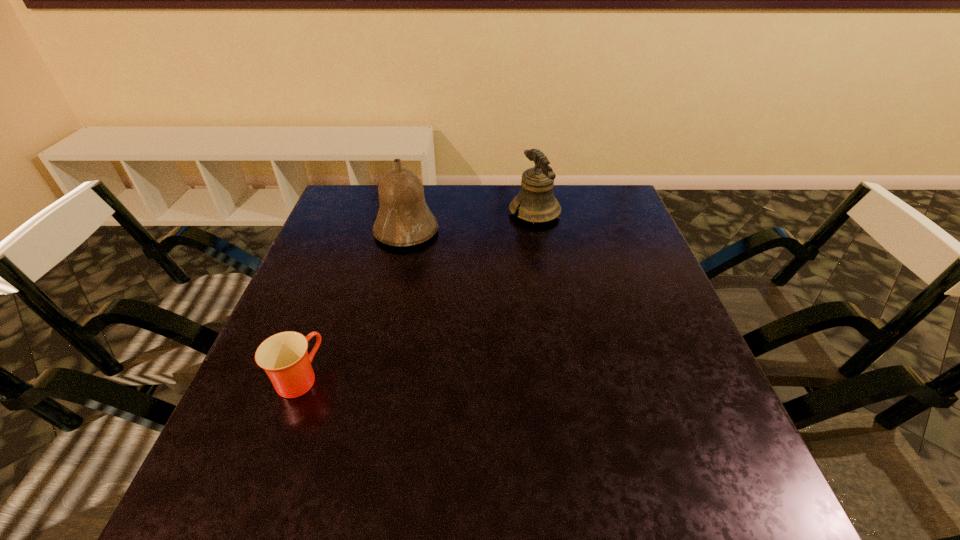
Where is `free space between the second object from right to left and the nearest object`? This screenshot has height=540, width=960. free space between the second object from right to left and the nearest object is located at coordinates tap(352, 305).

You are a GUI agent. You are given a task and a screenshot of the screen. Output one action in this format:
    pyautogui.click(x=<x>, y=<y>)
    Task: Click on the free space between the second object from left to right and the shortest object
    Image resolution: width=960 pixels, height=540 pixels.
    Given the screenshot: What is the action you would take?
    pyautogui.click(x=352, y=305)

Image resolution: width=960 pixels, height=540 pixels. What are the coordinates of `vacant space that is in between the second object from left to right and the leftmost object` in the screenshot? It's located at (352, 305).

This screenshot has width=960, height=540. Identify the location of unoccupied position between the leftmost object and the second object from left to right. (352, 305).

This screenshot has width=960, height=540. Identify the location of free space between the cup and the right bell. (417, 295).

Where is `free space between the nearest object and the right bell`? The image size is (960, 540). free space between the nearest object and the right bell is located at coordinates (417, 295).

Image resolution: width=960 pixels, height=540 pixels. I want to click on the closest object to the leftmost object, so click(x=404, y=219).

The image size is (960, 540). I want to click on object that is the second closest to the left bell, so click(284, 357).

Identify the location of free spot that satisfies the following two spatial constraints: 1. on the back side of the second object from right to left; 2. on the right side of the right bell. This screenshot has width=960, height=540. (410, 213).